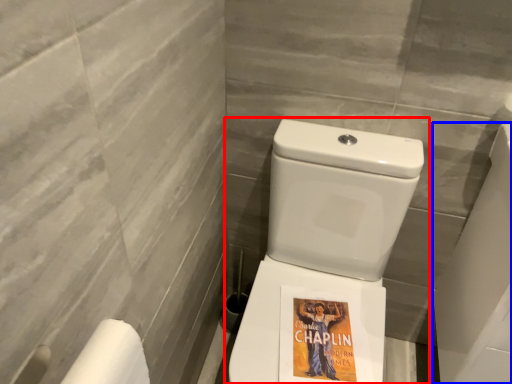
Question: Which of the following is the farthest to the observer, toilet (highlighted by a red box) or porcelain (highlighted by a blue box)?

Choices:
 (A) toilet
 (B) porcelain

Answer: (B)